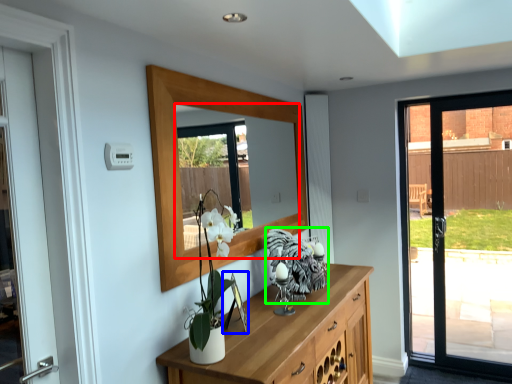
Question: Which is farther away from mirror (highlighted by a red box)? picture frame (highlighted by a blue box) or animal (highlighted by a green box)?

Choices:
 (A) picture frame
 (B) animal

Answer: (A)